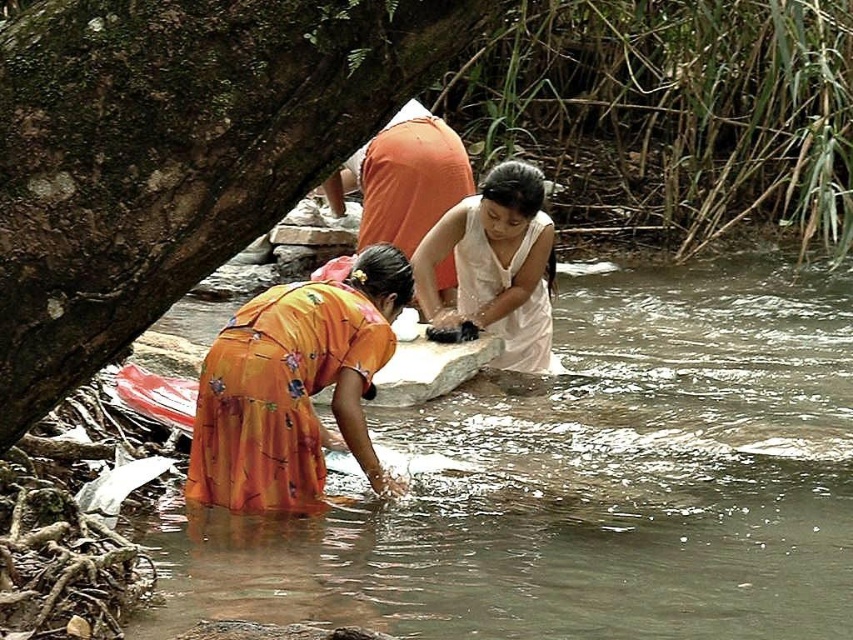
Question: Which point appears farthest from the camera in this image?

Choices:
 (A) (520, 288)
 (B) (236, 406)
 (C) (384, 134)

Answer: (C)

Question: Is orange floral dress at lower left to the left of orange fabric at center from the viewer's perspective?

Choices:
 (A) yes
 (B) no

Answer: (A)

Question: Is white matte cloth at center above orange fabric at center?

Choices:
 (A) yes
 (B) no

Answer: (B)

Question: Among these objects, which one is farthest from the camera?

Choices:
 (A) orange floral dress at lower left
 (B) orange fabric at center

Answer: (B)

Question: Among these objects, which one is farthest from the camera?

Choices:
 (A) white matte cloth at center
 (B) orange floral dress at lower left
 (C) orange fabric at center

Answer: (C)

Question: Can you confirm if orange floral dress at lower left is wider than orange fabric at center?

Choices:
 (A) no
 (B) yes

Answer: (B)